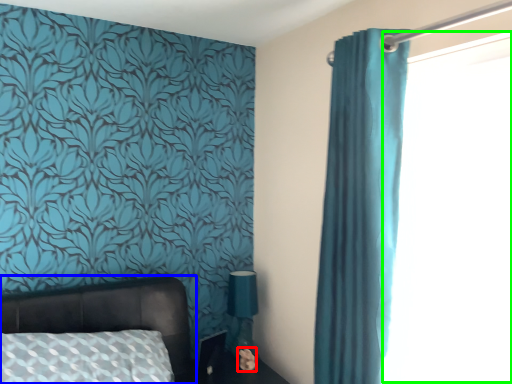
Question: Which object is the closest to the flower (highlighted by a red box)? Choose among these: bed (highlighted by a blue box) or window screen (highlighted by a green box).

Choices:
 (A) bed
 (B) window screen

Answer: (A)